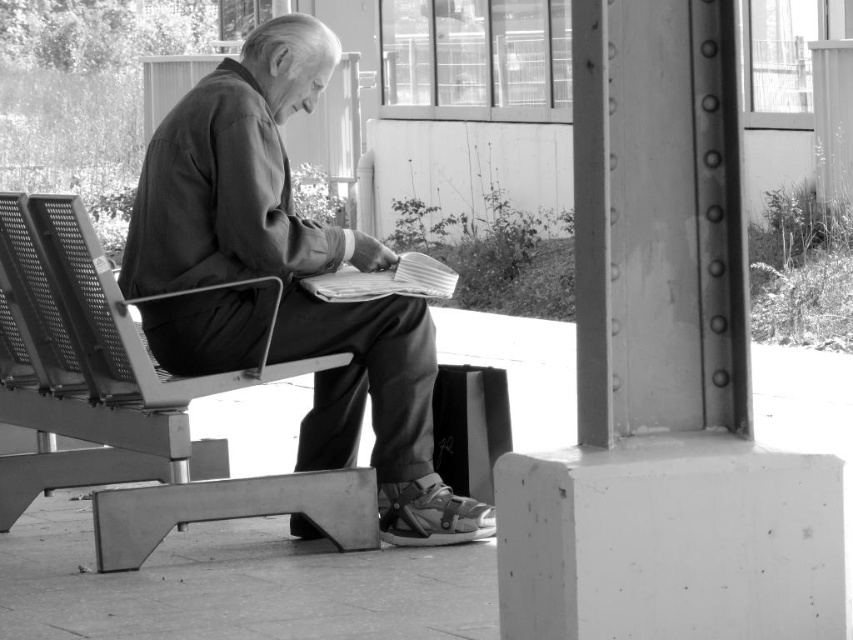
Based on the photo, who is higher up, matte black jacket at center or metallic mesh chair at left?

matte black jacket at center is higher up.

Does point (349, 372) come in front of point (6, 388)?

Yes, point (349, 372) is in front of point (6, 388).

At what (x,y) coordinates should I click in order to perform the action: click on matte black jacket at center. Please return your answer as a coordinate pair (x, y). Looking at the image, I should click on (296, 273).

Is smooth concrete pillar at right thinner than matte black jacket at center?

Yes, smooth concrete pillar at right is thinner than matte black jacket at center.

Find the location of a particular element. Image resolution: width=853 pixels, height=640 pixels. smooth concrete pillar at right is located at coordinates (664, 372).

Can you confirm if smooth concrete pillar at right is bigger than metallic mesh chair at left?

No.

Which is more to the left, smooth concrete pillar at right or metallic mesh chair at left?

metallic mesh chair at left is more to the left.

The height and width of the screenshot is (640, 853). What do you see at coordinates (664, 372) in the screenshot?
I see `smooth concrete pillar at right` at bounding box center [664, 372].

At what (x,y) coordinates should I click in order to perform the action: click on smooth concrete pillar at right. Please return your answer as a coordinate pair (x, y). This screenshot has height=640, width=853. Looking at the image, I should click on (664, 372).